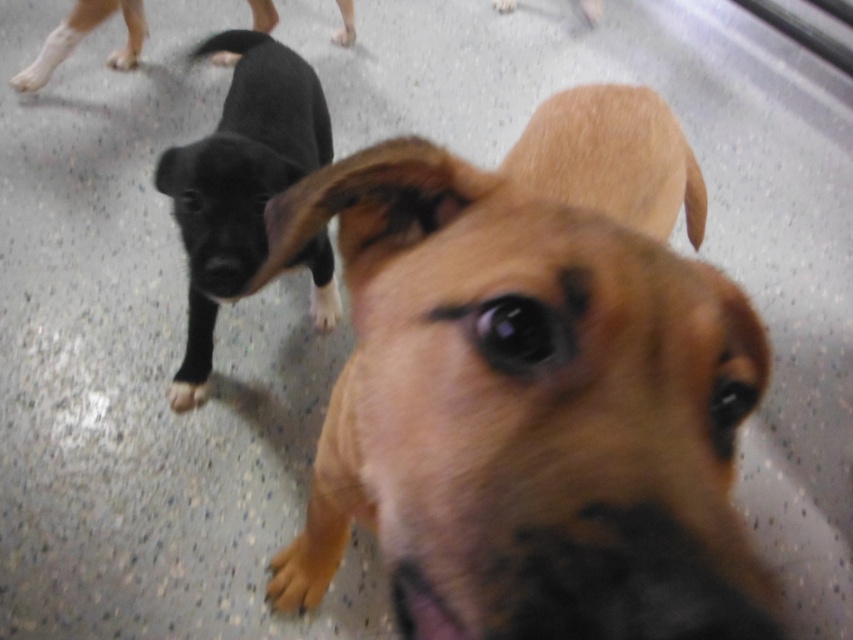
Is point (634, 147) positioned before point (219, 200)?

Yes, it is.

In the scene shown: Between brown furry dog at center and shiny black puppy at left, which one appears on the right side from the viewer's perspective?

From the viewer's perspective, brown furry dog at center appears more on the right side.

Who is more distant from viewer, (483, 588) or (244, 147)?

Point (244, 147)

The image size is (853, 640). What are the coordinates of `brown furry dog at center` in the screenshot? It's located at (532, 385).